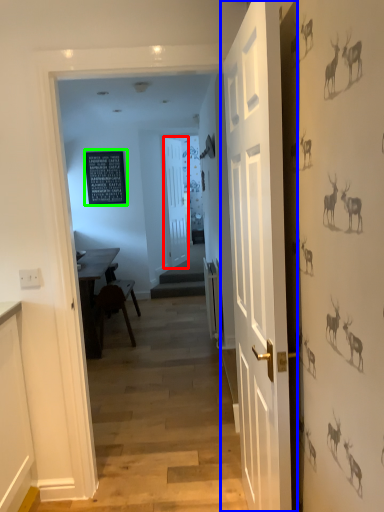
Question: Considering the real-world distances, which object is farthest from door (highlighted by a red box)? door (highlighted by a blue box) or bulletin board (highlighted by a green box)?

Choices:
 (A) door
 (B) bulletin board

Answer: (A)